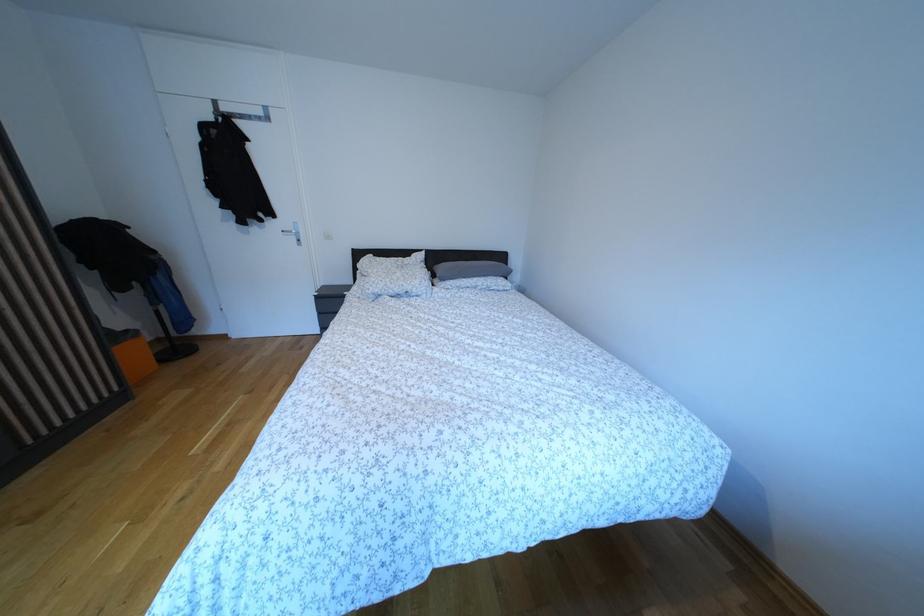
What are the coordinates of `patterned white pillow` in the screenshot? It's located at (392, 277).